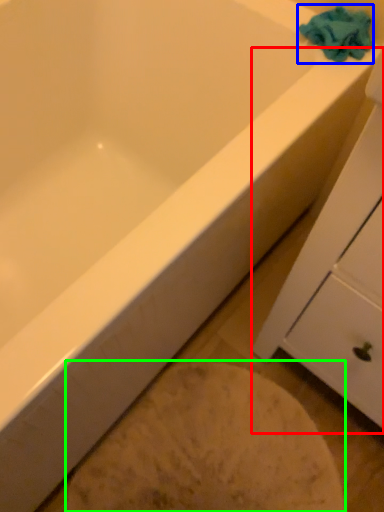
Question: Which object is positioned farthest from cabinetry (highlighted by a red box)? Select from bath towel (highlighted by a blue box) and porcelain (highlighted by a green box).

Choices:
 (A) bath towel
 (B) porcelain

Answer: (A)